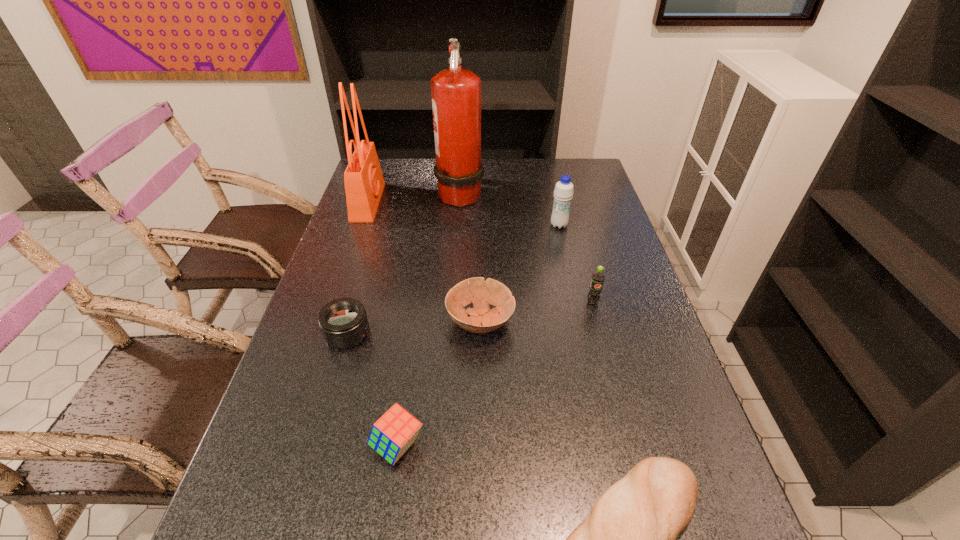
The image size is (960, 540). Identify the location of fire extinguisher. (456, 93).

Where is `tote bag`? This screenshot has width=960, height=540. tote bag is located at coordinates (364, 183).

The image size is (960, 540). I want to click on the sixth shortest object, so click(x=563, y=193).

Identify the location of soda. (598, 277).

Identify the location of cube. This screenshot has width=960, height=540. (393, 434).

Identify the location of bowl. The height and width of the screenshot is (540, 960). (481, 293).

Image resolution: width=960 pixels, height=540 pixels. Find the location of `telephoto lens`. telephoto lens is located at coordinates (343, 322).

Where is `vacant space located at the nozzle of the tallest object`? The height and width of the screenshot is (540, 960). vacant space located at the nozzle of the tallest object is located at coordinates (512, 193).

Where is `free space located 0.380m on the logo side of the tote bag`? Image resolution: width=960 pixels, height=540 pixels. free space located 0.380m on the logo side of the tote bag is located at coordinates (489, 202).

This screenshot has height=540, width=960. What are the coordinates of `free space located 0.150m on the back of the water bottle` in the screenshot? It's located at (552, 196).